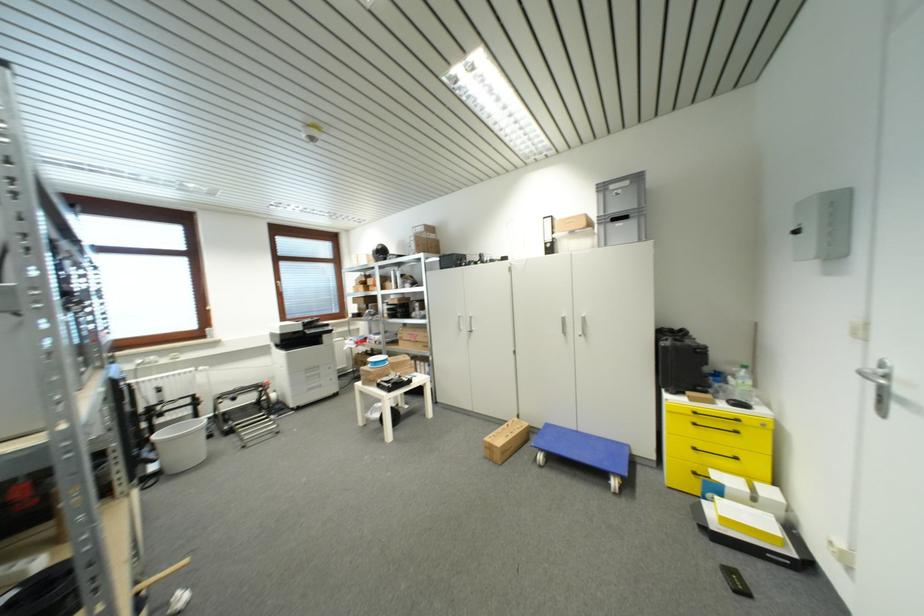
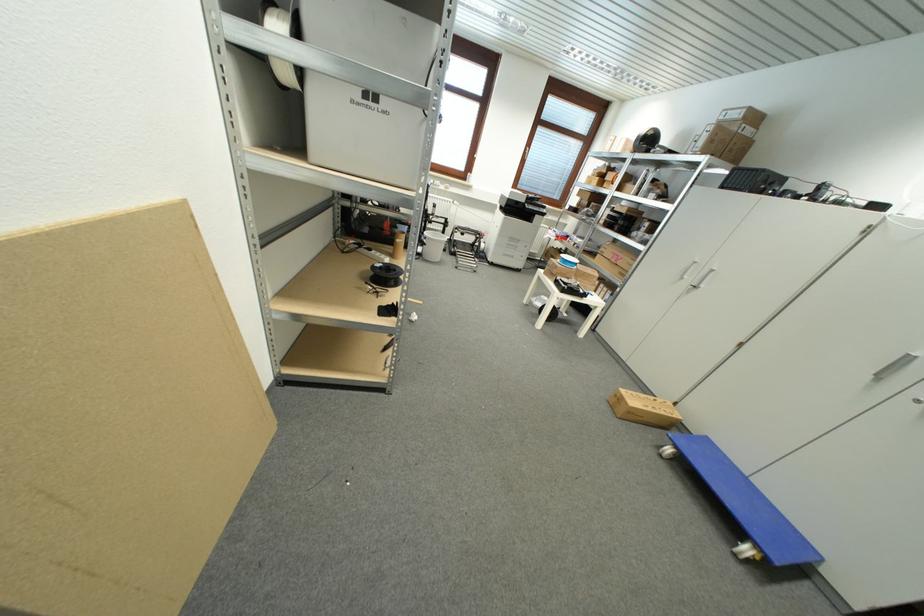
Find the pixel in the second image that matches pixel 567 321 in the first image.

(913, 361)